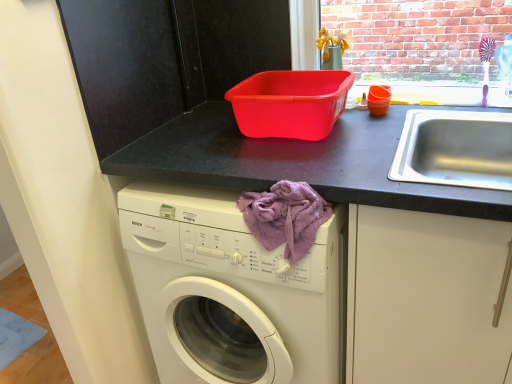
Measure the distance between point (328, 177) and camera.

A distance of 36.97 inches exists between point (328, 177) and camera.

Describe the element at coordinates (362, 234) in the screenshot. I see `matte black counter at upper center` at that location.

Locate an element on the screen. matte black counter at upper center is located at coordinates (362, 234).

The width and height of the screenshot is (512, 384). Describe the element at coordinates (285, 217) in the screenshot. I see `purple fabric at lower center` at that location.

I want to click on purple fabric at lower center, so click(285, 217).

This screenshot has width=512, height=384. Identify the location of matte black counter at upper center. (362, 234).

Which object is positioned more to the right, matte black counter at upper center or purple fabric at lower center?

Positioned to the right is purple fabric at lower center.

Who is more distant, matte black counter at upper center or purple fabric at lower center?

purple fabric at lower center.

Between point (452, 201) and point (277, 210), which one is positioned behind?

The point (277, 210) is farther.

From the image's perspective, is matte black counter at upper center located above or below purple fabric at lower center?

matte black counter at upper center is below purple fabric at lower center.

From a real-world perspective, is matte black counter at upper center positioned under purple fabric at lower center based on gravity?

Yes, from a real-world perspective, matte black counter at upper center is under purple fabric at lower center.

Which object is thinner, matte black counter at upper center or purple fabric at lower center?

purple fabric at lower center.

In terms of height, does matte black counter at upper center look taller or shorter compared to purple fabric at lower center?

Considering their sizes, matte black counter at upper center has more height than purple fabric at lower center.

Considering the sizes of objects matte black counter at upper center and purple fabric at lower center in the image provided, who is smaller, matte black counter at upper center or purple fabric at lower center?

Smaller between the two is purple fabric at lower center.

Would you say matte black counter at upper center is outside purple fabric at lower center?

Yes, matte black counter at upper center is not within purple fabric at lower center.

Looking at this image, is matte black counter at upper center not close to purple fabric at lower center?

No, matte black counter at upper center is not far from purple fabric at lower center.

Is matte black counter at upper center positioned with its back to purple fabric at lower center?

No.

Looking at this image, what's the angular difference between matte black counter at upper center and purple fabric at lower center's facing directions?

There is a 1.31-degree angle between the facing directions of matte black counter at upper center and purple fabric at lower center.

Measure the distance between matte black counter at upper center and purple fabric at lower center.

matte black counter at upper center and purple fabric at lower center are 8.20 inches apart from each other.

Where is `blanket above the matte black counter at upper center (from a real-world perspective)`? This screenshot has height=384, width=512. blanket above the matte black counter at upper center (from a real-world perspective) is located at coordinates (285, 217).

Is purple fabric at lower center to the right of matte black counter at upper center from the viewer's perspective?

Yes.

Which object is closer to the camera, purple fabric at lower center or matte black counter at upper center?

matte black counter at upper center is more forward.

Is point (296, 242) positioned after point (360, 158)?

No, (296, 242) is in front of (360, 158).

From the image's perspective, does purple fabric at lower center appear lower than matte black counter at upper center?

Incorrect, from the image's perspective, purple fabric at lower center is higher than matte black counter at upper center.

From a real-world perspective, is purple fabric at lower center above or below matte black counter at upper center?

From a real-world perspective, purple fabric at lower center is physically above matte black counter at upper center.

Is purple fabric at lower center thinner than matte black counter at upper center?

Yes.

Can you confirm if purple fabric at lower center is shorter than matte black counter at upper center?

Yes, purple fabric at lower center is shorter than matte black counter at upper center.

Can you confirm if purple fabric at lower center is bigger than matte black counter at upper center?

No, purple fabric at lower center is not bigger than matte black counter at upper center.

Consider the image. Would you say matte black counter at upper center is part of purple fabric at lower center's contents?

That's incorrect, matte black counter at upper center is not inside purple fabric at lower center.

Looking at this image, is purple fabric at lower center next to matte black counter at upper center and touching it?

No, purple fabric at lower center is not making contact with matte black counter at upper center.

Is purple fabric at lower center aimed at matte black counter at upper center?

Yes, purple fabric at lower center faces towards matte black counter at upper center.

What's the angular difference between purple fabric at lower center and matte black counter at upper center's facing directions?

They differ by 1.31 degrees in their facing directions.

How far apart are purple fabric at lower center and matte black counter at upper center?

purple fabric at lower center and matte black counter at upper center are 20.83 centimeters apart from each other.

Where is `blanket lying on the right of matte black counter at upper center`? blanket lying on the right of matte black counter at upper center is located at coordinates (285, 217).

The width and height of the screenshot is (512, 384). Identify the location of counter on the left of purple fabric at lower center. (362, 234).

You are a GUI agent. You are given a task and a screenshot of the screen. Output one action in this format:
    pyautogui.click(x=<x>, y=<y>)
    Task: Click on the blanket on the right of matte black counter at upper center
    Image resolution: width=512 pixels, height=384 pixels.
    Given the screenshot: What is the action you would take?
    pyautogui.click(x=285, y=217)